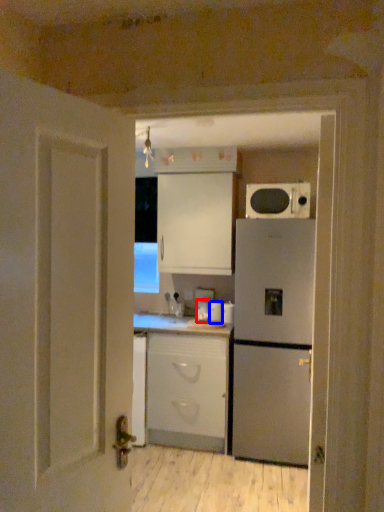
Question: Which object appears closest to the camera in this image, appliance (highlighted by a red box) or appliance (highlighted by a blue box)?

Choices:
 (A) appliance
 (B) appliance

Answer: (B)